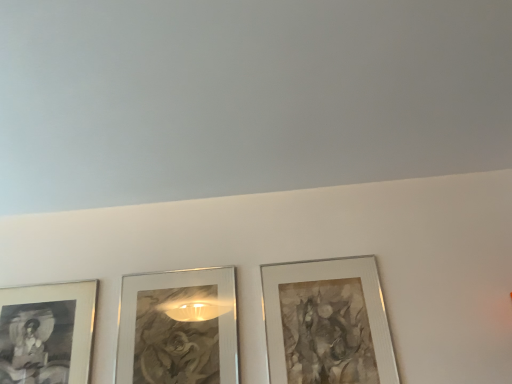
Question: Is metallic silver picture frame at center, marked as the second picture frame in a left-to-right arrangement, to the left or to the right of matte black picture frame at lower left, placed as the 1th picture frame when sorted from left to right, in the image?

Choices:
 (A) left
 (B) right

Answer: (B)

Question: Is metallic silver picture frame at center, marked as the second picture frame in a left-to-right arrangement, spatially inside matte black picture frame at lower left, placed as the 1th picture frame when sorted from left to right, or outside of it?

Choices:
 (A) inside
 (B) outside

Answer: (B)

Question: Considering the real-world distances, which object is closest to the matte black picture frame at lower left, the 3th picture frame from the right?

Choices:
 (A) silver metallic picture frame at center right, placed as the 1th picture frame when sorted from right to left
 (B) metallic silver picture frame at center, marked as the second picture frame in a left-to-right arrangement

Answer: (B)

Question: Which object is the closest to the silver metallic picture frame at center right, placed as the 1th picture frame when sorted from right to left?

Choices:
 (A) metallic silver picture frame at center, which is the second picture frame in right-to-left order
 (B) matte black picture frame at lower left, placed as the 1th picture frame when sorted from left to right

Answer: (A)